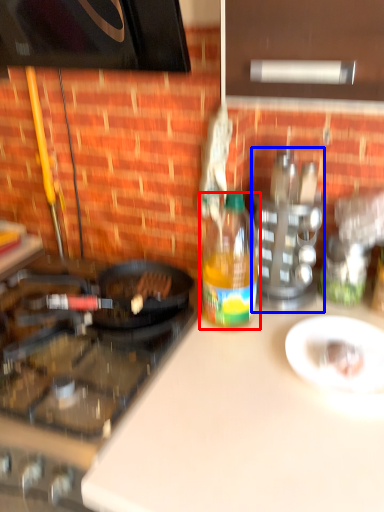
Question: Which object is further to the camera taking this photo, bottle (highlighted by a red box) or appliance (highlighted by a blue box)?

Choices:
 (A) bottle
 (B) appliance

Answer: (B)